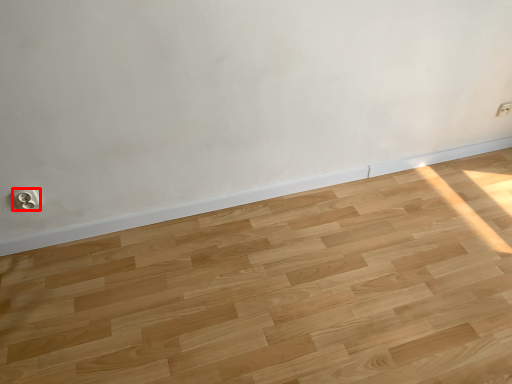
Question: From the image, what is the correct spatial relationship of electric outlet (annotated by the red box) in relation to electric outlet?

Choices:
 (A) left
 (B) right

Answer: (A)